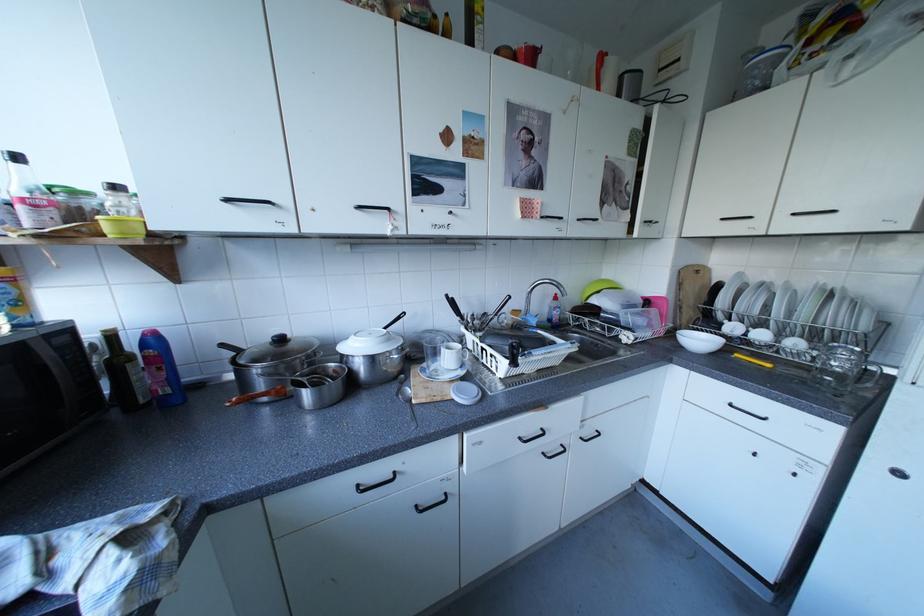
Identify the location of glass mug handle. The height and width of the screenshot is (616, 924). (455, 354).